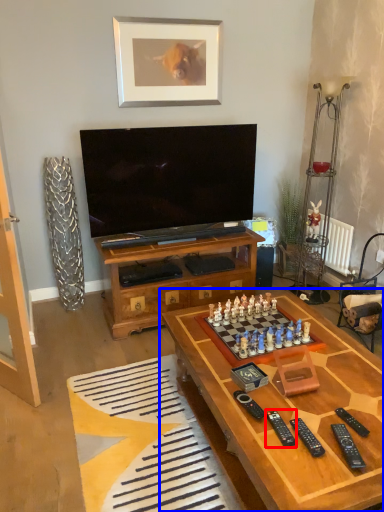
Question: Which point is closer to the camera, remote (highlighted by a red box) or table (highlighted by a blue box)?

Choices:
 (A) remote
 (B) table

Answer: (B)